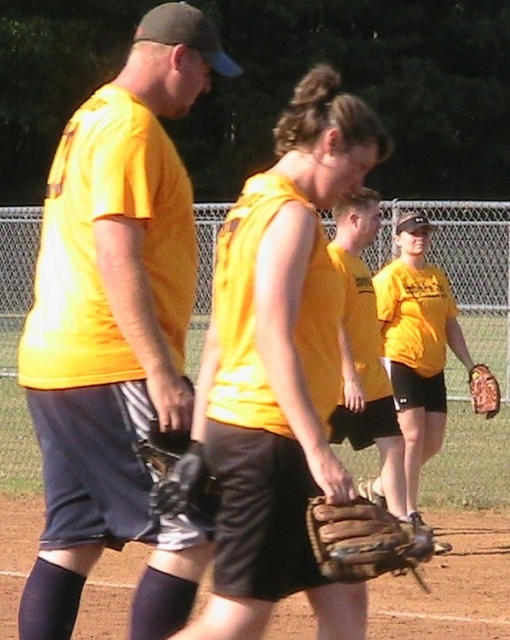
Where is the brown leather glove at center located in the image?

The brown leather glove at center is located at point coordinates of (364, 540).

You are standing at the origin point of the image coordinate system. Which object is located at the point with coordinates (116,330)?

The matte yellow shirt at left is located at point (116,330).

In the image of the baseball game, there is a point labeled at coordinates (x=364, y=540). What object is located at this point?

The point at coordinates (x=364, y=540) corresponds to the brown leather glove at center.